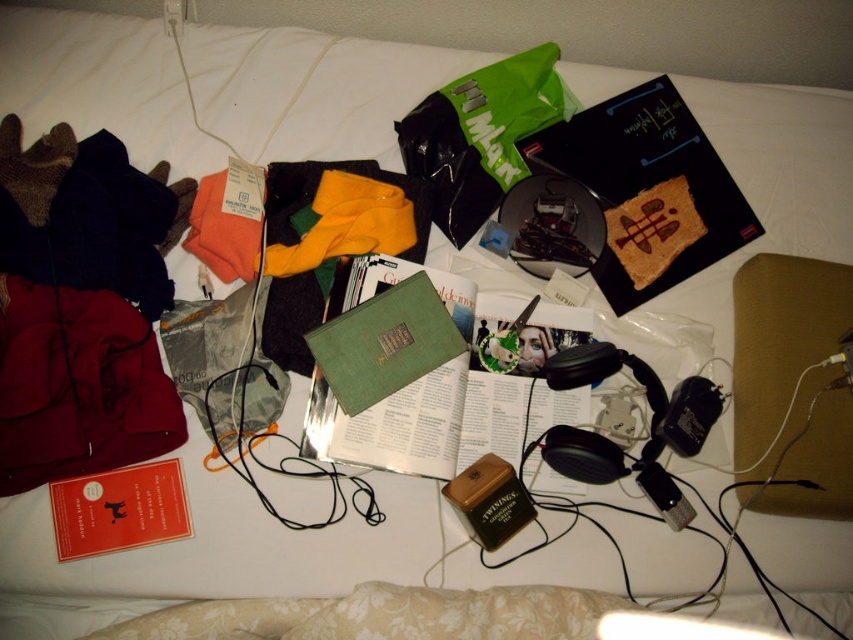
Question: Estimate the real-world distances between objects in this image. Which object is closer to the dark red fabric at left?

Choices:
 (A) hardcover book at center
 (B) green matte book at center

Answer: (B)

Question: Can you confirm if green matte book at center is positioned to the right of dark red fabric at left?

Choices:
 (A) no
 (B) yes

Answer: (B)

Question: Does dark red fabric at left come behind hardcover book at center?

Choices:
 (A) no
 (B) yes

Answer: (A)

Question: Is green matte book at center positioned behind dark red fabric at left?

Choices:
 (A) no
 (B) yes

Answer: (B)

Question: Which is farther from the dark red fabric at left?

Choices:
 (A) hardcover book at center
 (B) green matte book at center

Answer: (A)

Question: Which point is farther to the camera?

Choices:
 (A) (579, 182)
 (B) (399, 262)
 (C) (16, 276)

Answer: (A)